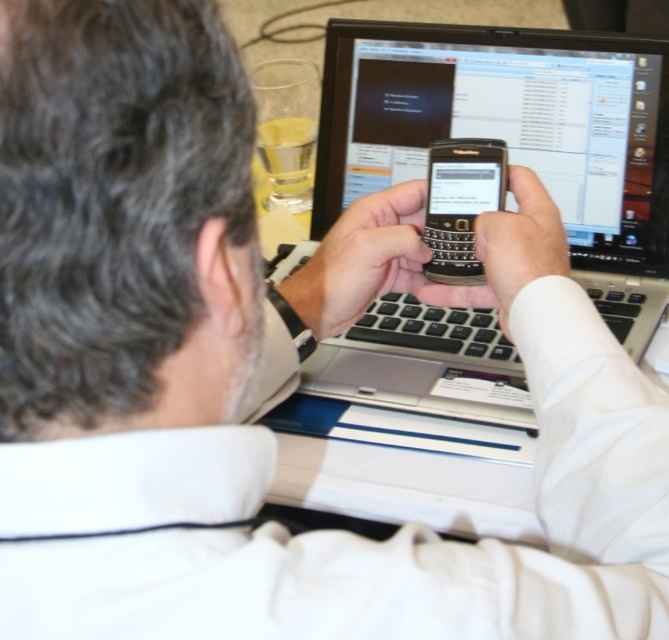
Question: Which point is farther to the camera?

Choices:
 (A) silver metallic laptop at center
 (B) black plastic smartphone at center

Answer: (A)

Question: Among these objects, which one is nearest to the camera?

Choices:
 (A) black plastic smartphone at center
 (B) silver metallic laptop at center

Answer: (A)

Question: Can you confirm if silver metallic laptop at center is smaller than black plastic smartphone at center?

Choices:
 (A) yes
 (B) no

Answer: (B)

Question: Considering the relative positions of silver metallic laptop at center and black plastic smartphone at center in the image provided, where is silver metallic laptop at center located with respect to black plastic smartphone at center?

Choices:
 (A) below
 (B) above

Answer: (B)

Question: Does silver metallic laptop at center lie in front of black plastic smartphone at center?

Choices:
 (A) no
 (B) yes

Answer: (A)